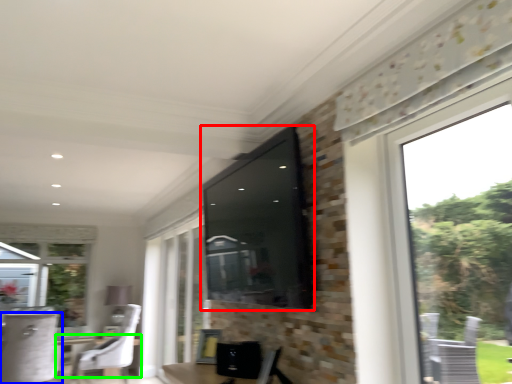
Question: Estimate the real-world distances between objects in this image. Which object is farther from window screen (highlighted by a red box), chair (highlighted by a blue box) or round table (highlighted by a green box)?

Choices:
 (A) chair
 (B) round table

Answer: (B)